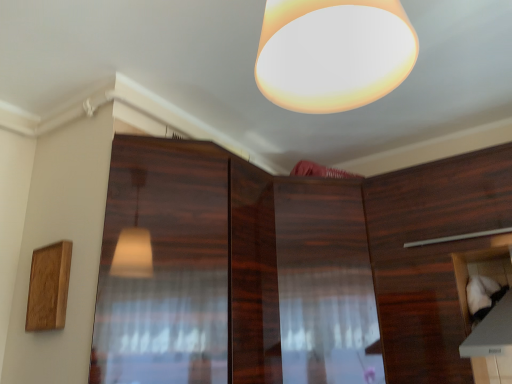
Question: Is wooden cabinet at center, which ranks as the 1th cabinetry in left-to-right order, taller than white fabric at lower right, arranged as the 3th cabinetry when viewed from the left?

Choices:
 (A) yes
 (B) no

Answer: (A)

Question: Is wooden cabinet at center, which ranks as the 1th cabinetry in left-to-right order, further to camera compared to white fabric at lower right, the 1th cabinetry from the right?

Choices:
 (A) yes
 (B) no

Answer: (A)

Question: Is wooden cabinet at center, which ranks as the 1th cabinetry in left-to-right order, facing away from white fabric at lower right, the 1th cabinetry from the right?

Choices:
 (A) no
 (B) yes

Answer: (A)

Question: Is white fabric at lower right, arranged as the 3th cabinetry when viewed from the left, surrounded by wooden cabinet at center, arranged as the 3th cabinetry when viewed from the right?

Choices:
 (A) no
 (B) yes

Answer: (A)

Question: Can you confirm if wooden cabinet at center, which ranks as the 1th cabinetry in left-to-right order, is wider than white fabric at lower right, the 1th cabinetry from the right?

Choices:
 (A) no
 (B) yes

Answer: (B)

Question: Is white fabric at lower right, arranged as the 3th cabinetry when viewed from the left, completely or partially inside matte white lampshade at upper center?

Choices:
 (A) no
 (B) yes

Answer: (A)

Question: Is there a large distance between matte white lampshade at upper center and white fabric at lower right, the 1th cabinetry from the right?

Choices:
 (A) yes
 (B) no

Answer: (A)

Question: Can you confirm if matte white lampshade at upper center is positioned to the left of white fabric at lower right, arranged as the 3th cabinetry when viewed from the left?

Choices:
 (A) no
 (B) yes

Answer: (B)

Question: From the image's perspective, does matte white lampshade at upper center appear lower than white fabric at lower right, the 1th cabinetry from the right?

Choices:
 (A) yes
 (B) no

Answer: (B)

Question: Is matte white lampshade at upper center oriented away from white fabric at lower right, the 1th cabinetry from the right?

Choices:
 (A) yes
 (B) no

Answer: (B)

Question: From a real-world perspective, is matte white lampshade at upper center on top of white fabric at lower right, arranged as the 3th cabinetry when viewed from the left?

Choices:
 (A) no
 (B) yes

Answer: (B)

Question: Is wooden cabinet at right, which ranks as the second cabinetry in left-to-right order, shorter than wooden cabinet at center, arranged as the 3th cabinetry when viewed from the right?

Choices:
 (A) no
 (B) yes

Answer: (B)